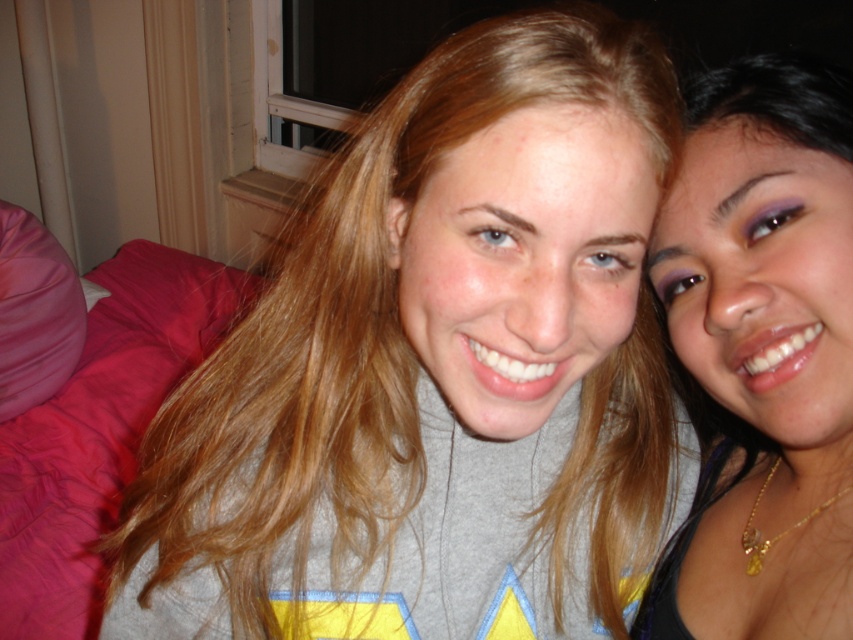
Consider the image. You are holding a 50 cm long ruler and want to measure the distance from the camera to the point marked at coordinates point (440, 410). Can you reach the point with the ruler?

The distance of point (440, 410) from camera is 51.15 centimeters, so the ruler is 50 cm long and cannot reach the point.

You are a photographer adjusting the camera height to capture both the gray matte sweatshirt at center and the matte gold necklace at right in the frame. Which object should you position closer to the bottom of the frame?

The gray matte sweatshirt at center is shorter than the matte gold necklace at right, so you should position the gray matte sweatshirt at center closer to the bottom of the frame to ensure both are visible in the composition.

You are standing in the room where the two people are posing. You want to place a small decoration exactly halfway between the point at (125, 541) and the point at (775, 58). Will the decoration be closer to the people or the window?

The decoration placed halfway between the point at (125, 541) and the point at (775, 58) will be closer to the people because point (125, 541) is closer to the viewer than point (775, 58).